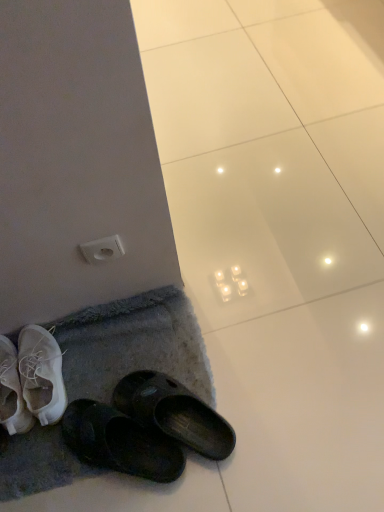
Question: Do you think white plastic outlet at upper left is within gray textured bath mat at lower left, or outside of it?

Choices:
 (A) inside
 (B) outside

Answer: (B)

Question: Considering the positions of point (102, 246) and point (46, 452), is point (102, 246) closer or farther from the camera than point (46, 452)?

Choices:
 (A) farther
 (B) closer

Answer: (B)

Question: In terms of height, does white plastic outlet at upper left look taller or shorter compared to gray textured bath mat at lower left?

Choices:
 (A) tall
 (B) short

Answer: (A)

Question: From a real-world perspective, relative to white plastic outlet at upper left, is gray textured bath mat at lower left vertically above or below?

Choices:
 (A) below
 (B) above

Answer: (A)

Question: Is point (x=74, y=344) closer or farther from the camera than point (x=102, y=259)?

Choices:
 (A) closer
 (B) farther

Answer: (B)

Question: Is gray textured bath mat at lower left taller or shorter than white plastic outlet at upper left?

Choices:
 (A) tall
 (B) short

Answer: (B)

Question: Is gray textured bath mat at lower left bigger or smaller than white plastic outlet at upper left?

Choices:
 (A) small
 (B) big

Answer: (B)